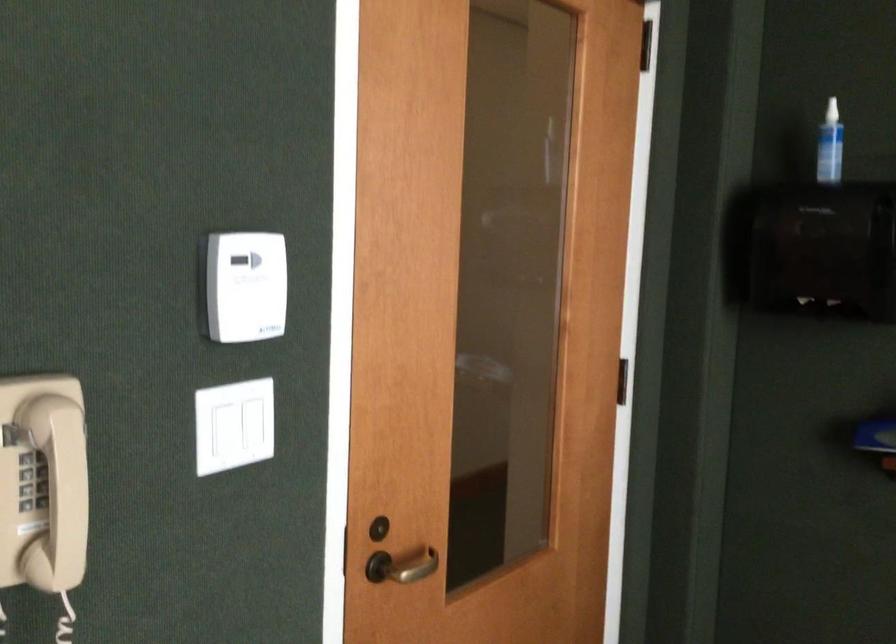
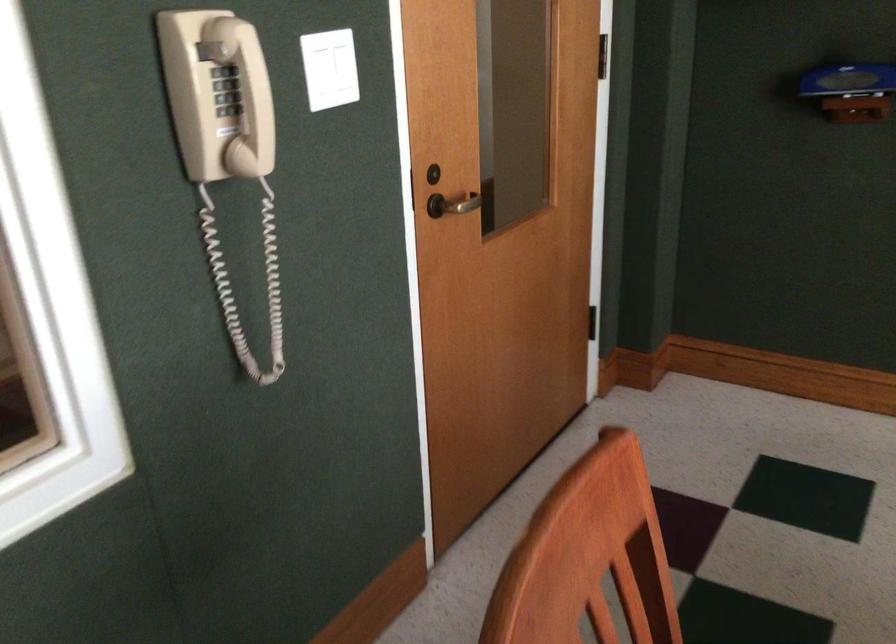
In the second image, find the point that corresponds to (406,576) in the first image.

(458, 204)